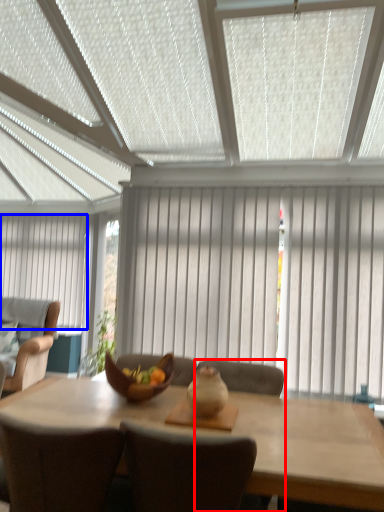
Question: Which object is further to the camera taking this photo, chair (highlighted by a red box) or curtain (highlighted by a blue box)?

Choices:
 (A) chair
 (B) curtain

Answer: (B)